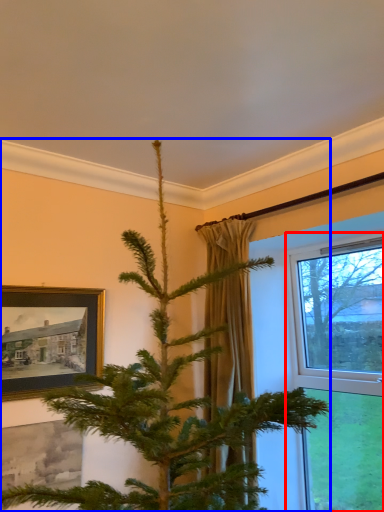
Question: Which object is closer to the camera taking this photo, window (highlighted by a red box) or christmas tree (highlighted by a blue box)?

Choices:
 (A) window
 (B) christmas tree

Answer: (B)